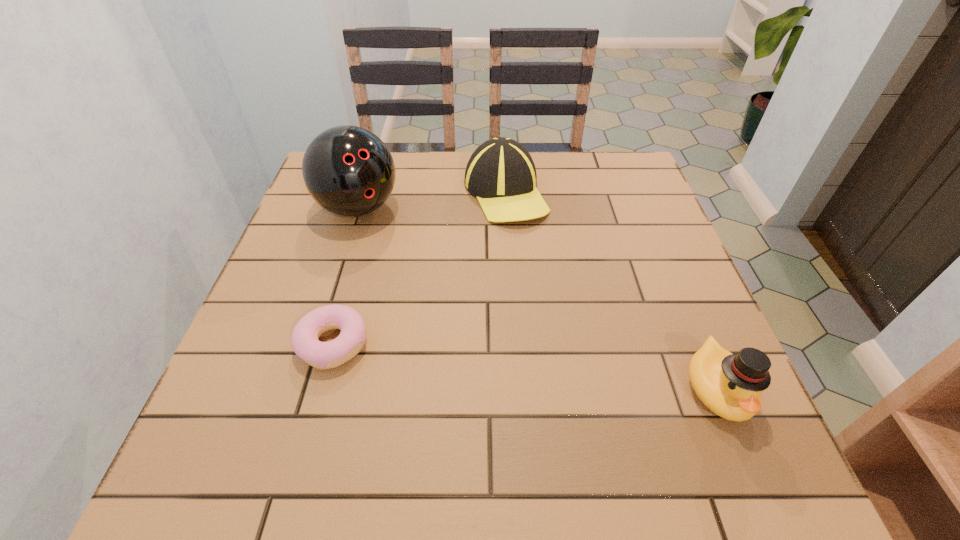
Locate an element on the screen. doughnut is located at coordinates (304, 340).

At what (x,y) coordinates should I click in order to perform the action: click on duck. Please return your answer as a coordinate pair (x, y). The width and height of the screenshot is (960, 540). Looking at the image, I should click on (730, 385).

At what (x,y) coordinates should I click in order to perform the action: click on the second object from right to left. Please return your answer as a coordinate pair (x, y). The width and height of the screenshot is (960, 540). Looking at the image, I should click on [x=501, y=173].

The width and height of the screenshot is (960, 540). I want to click on the tallest object, so click(x=349, y=171).

Identify the location of free space located on the front of the doughnut. The image size is (960, 540). (310, 427).

Locate an element on the screen. The width and height of the screenshot is (960, 540). free space located with the brim of the second object from right to left facing forward is located at coordinates (520, 280).

You are a GUI agent. You are given a task and a screenshot of the screen. Output one action in this format:
    pyautogui.click(x=<x>, y=<y>)
    Task: Click on the vacant space situated with the brim of the second object from right to left facing forward
    This screenshot has height=540, width=960.
    Given the screenshot: What is the action you would take?
    pyautogui.click(x=536, y=366)

Image resolution: width=960 pixels, height=540 pixels. I want to click on vacant space located with the brim of the second object from right to left facing forward, so click(x=530, y=331).

I want to click on free space located on the surface of the tallest object near the finger holes, so click(400, 257).

This screenshot has height=540, width=960. Find the location of `vacant space located on the surface of the tallest object near the finger holes`. vacant space located on the surface of the tallest object near the finger holes is located at coordinates (415, 275).